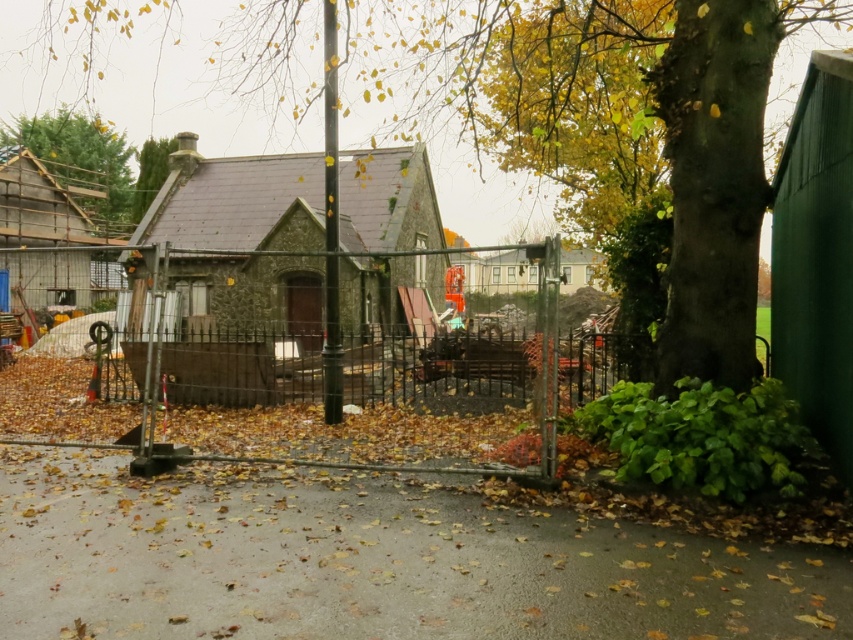
Between green rough bark tree at center and green textured wood at upper left, which one has more height?

Standing taller between the two is green rough bark tree at center.

Identify the location of green rough bark tree at center. The height and width of the screenshot is (640, 853). (171, 65).

What do you see at coordinates (171, 65) in the screenshot?
I see `green rough bark tree at center` at bounding box center [171, 65].

The width and height of the screenshot is (853, 640). Find the location of `green rough bark tree at center`. green rough bark tree at center is located at coordinates (171, 65).